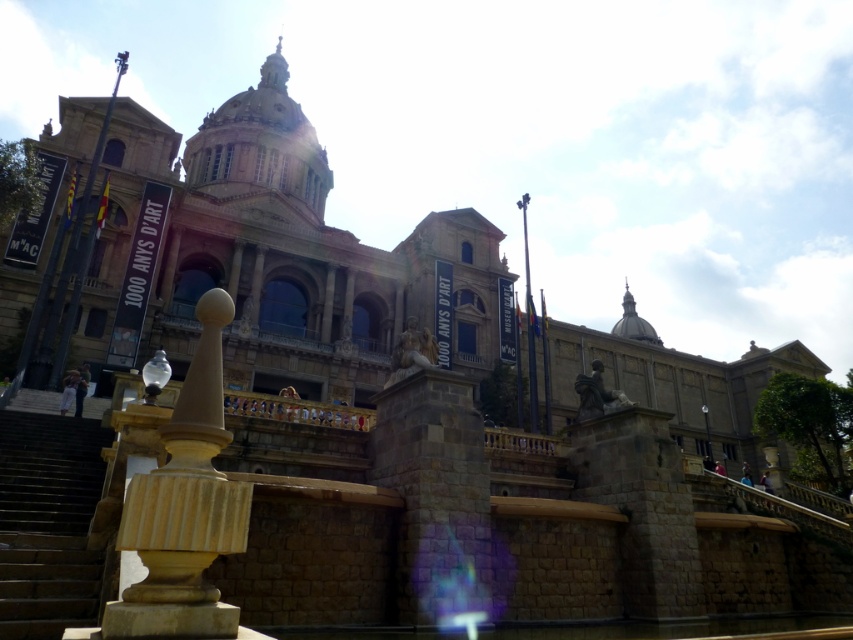
You are a tourist standing in front of the grand historical building. You notice the brown stone church at center and the beige polished stone pillar at center. Which object is closer to you?

The brown stone church at center is closer to you because the beige polished stone pillar at center is behind it.

You are standing in front of the grand historical building described. There is a point marked at coordinates (277, 259). According to the image, what does this point correspond to?

The point at coordinates (277, 259) corresponds to the brown stone church at center.